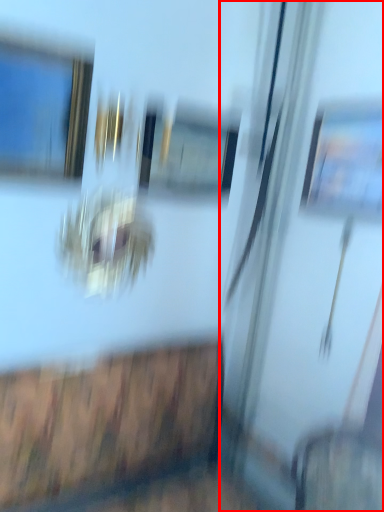
Question: In this image, where is screen door (annotated by the red box) located relative to window?

Choices:
 (A) right
 (B) left

Answer: (A)